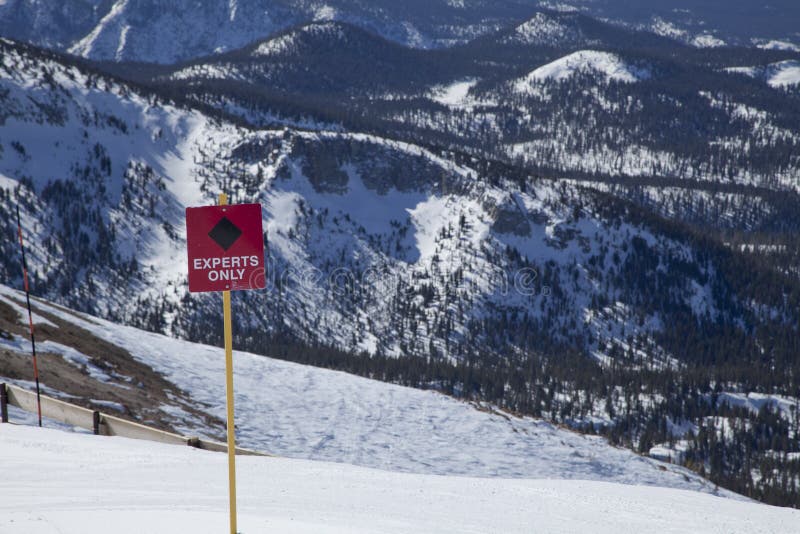
I want to click on benches, so click(x=65, y=406), click(x=113, y=429), click(x=194, y=445).